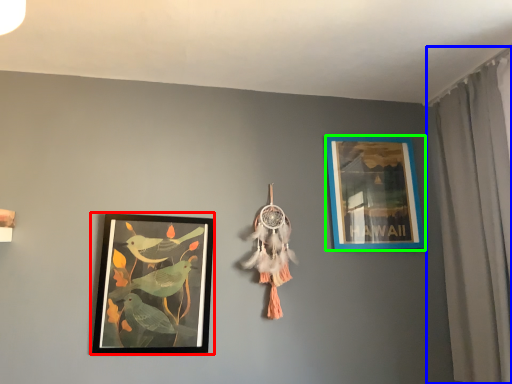
Question: Based on their relative distances, which object is nearer to picture frame (highlighted by a red box)? Choose from curtain (highlighted by a blue box) and picture frame (highlighted by a green box).

Choices:
 (A) curtain
 (B) picture frame

Answer: (B)